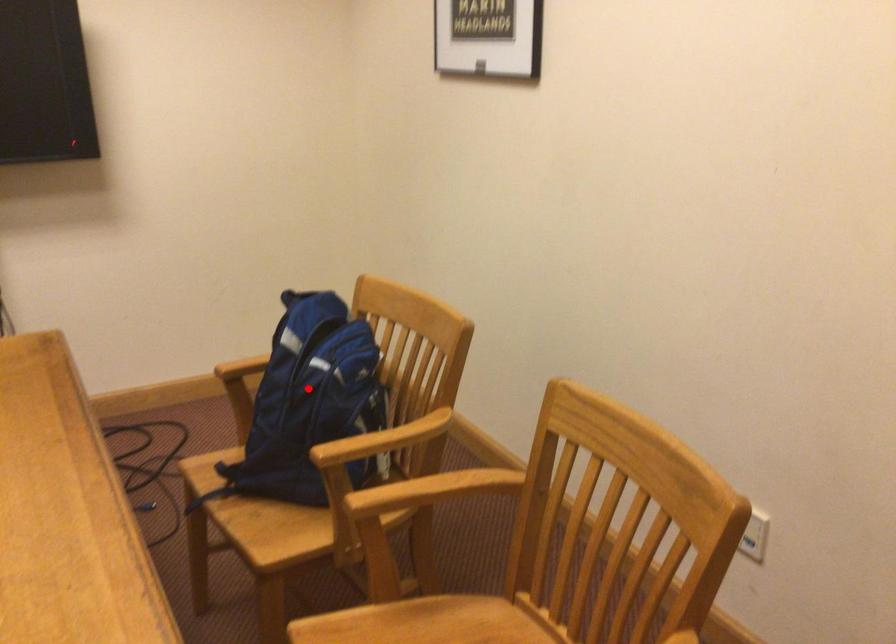
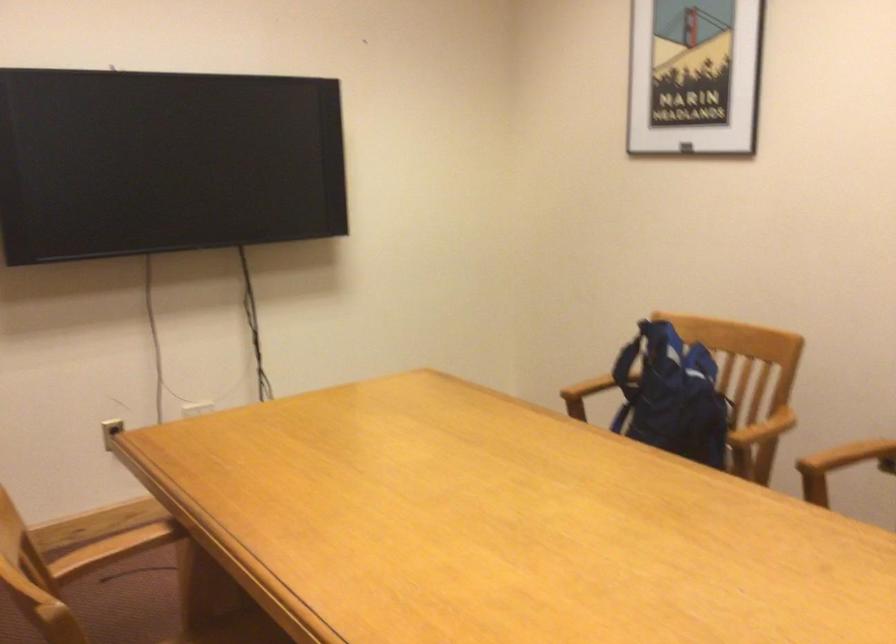
Question: I am providing you with two images of the same scene from different viewpoints. Given a red point in image1, look at the same physical point in image2. Is it:

Choices:
 (A) Closer to the viewpoint
 (B) Farther from the viewpoint

Answer: (B)